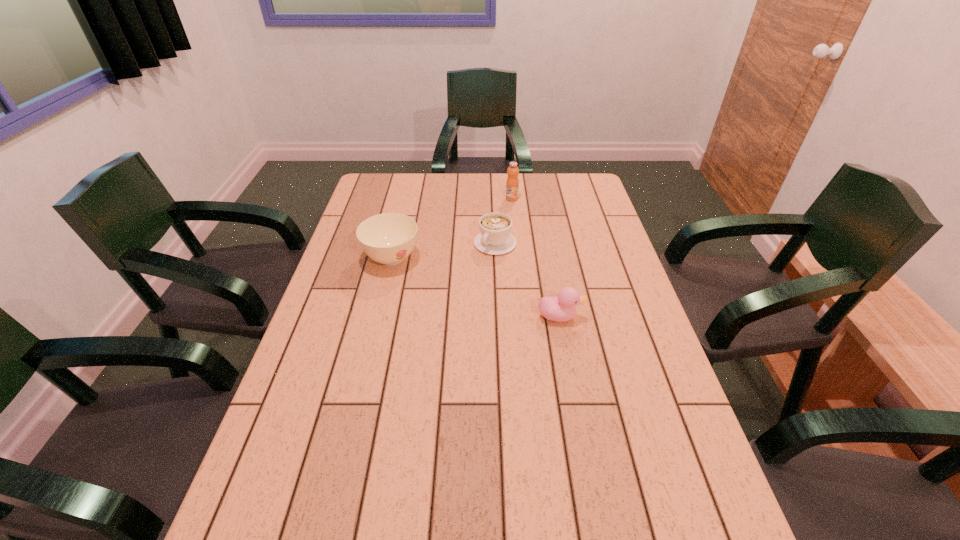
Identify which object is the second closest to the orange juice. Please provide its 2D coordinates. Your answer should be formatted as a tuple, i.e. [(x, y)], where the tuple contains the x and y coordinates of a point satisfying the conditions above.

[(388, 238)]

Locate an element on the screen. The height and width of the screenshot is (540, 960). free spot that satisfies the following two spatial constraints: 1. on the back side of the sugar bowl; 2. on the right side of the cappuccino is located at coordinates (396, 244).

Image resolution: width=960 pixels, height=540 pixels. Find the location of `vacant space that satisfies the following two spatial constraints: 1. on the front side of the leftmost object; 2. on the front-facing side of the duckling`. vacant space that satisfies the following two spatial constraints: 1. on the front side of the leftmost object; 2. on the front-facing side of the duckling is located at coordinates (378, 316).